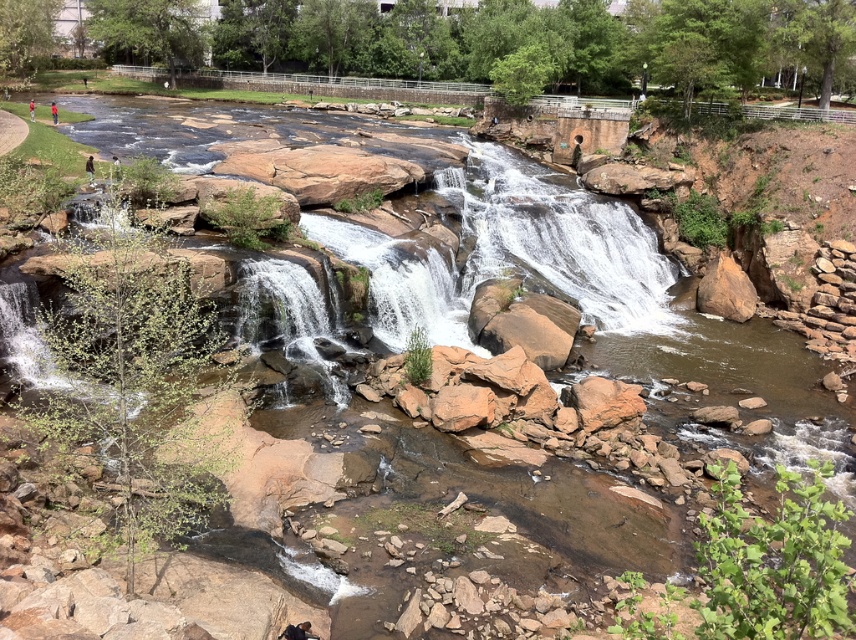
Find the location of a particular element. white smooth waterfall at center is located at coordinates (559, 241).

Which of these two, white smooth waterfall at center or red shirt at center, stands taller?

white smooth waterfall at center

Is point (616, 324) behind point (30, 113)?

No, it is not.

This screenshot has width=856, height=640. In order to click on white smooth waterfall at center in this screenshot , I will do `click(559, 241)`.

Between green fabric person at upper left and red shirt at center, which one appears on the right side from the viewer's perspective?

green fabric person at upper left

Which is more to the left, green fabric person at upper left or red shirt at center?

red shirt at center

Describe the element at coordinates (116, 168) in the screenshot. Image resolution: width=856 pixels, height=640 pixels. I see `green fabric person at upper left` at that location.

I want to click on green fabric person at upper left, so click(116, 168).

Who is more forward, (474,212) or (91,156)?

Point (91,156)

Is white smooth waterfall at center bigger than brown leather jacket at upper left?

Correct, white smooth waterfall at center is larger in size than brown leather jacket at upper left.

Which is in front, point (575, 253) or point (91, 161)?

Positioned in front is point (91, 161).

Image resolution: width=856 pixels, height=640 pixels. Identify the location of white smooth waterfall at center. (559, 241).